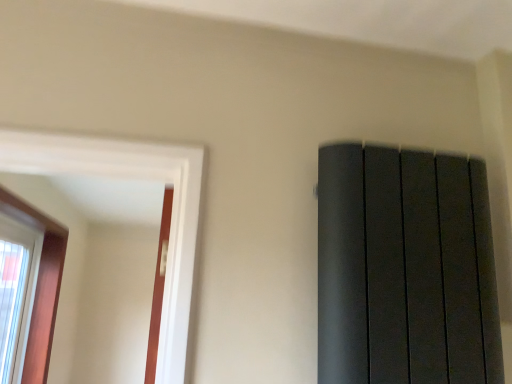
Question: In terms of width, does wooden frame window at left, positioned as the 1th window in right-to-left order, look wider or thinner when compared to clear glass window at left, the first window when ordered from left to right?

Choices:
 (A) wide
 (B) thin

Answer: (A)

Question: Considering the positions of wooden frame window at left, which ranks as the second window in left-to-right order, and clear glass window at left, the first window when ordered from left to right, in the image, is wooden frame window at left, which ranks as the second window in left-to-right order, bigger or smaller than clear glass window at left, the first window when ordered from left to right,?

Choices:
 (A) big
 (B) small

Answer: (A)

Question: From the image's perspective, is wooden frame window at left, positioned as the 1th window in right-to-left order, above or below clear glass window at left, the first window when ordered from left to right?

Choices:
 (A) above
 (B) below

Answer: (A)

Question: Based on their sizes in the image, would you say clear glass window at left, the 2th window positioned from the right, is bigger or smaller than wooden frame window at left, which ranks as the second window in left-to-right order?

Choices:
 (A) small
 (B) big

Answer: (A)

Question: Is clear glass window at left, the 2th window positioned from the right, in front of or behind wooden frame window at left, positioned as the 1th window in right-to-left order, in the image?

Choices:
 (A) front
 (B) behind

Answer: (B)

Question: From a real-world perspective, is clear glass window at left, the 2th window positioned from the right, above or below wooden frame window at left, which ranks as the second window in left-to-right order?

Choices:
 (A) above
 (B) below

Answer: (B)

Question: Is clear glass window at left, the 2th window positioned from the right, spatially inside wooden frame window at left, which ranks as the second window in left-to-right order, or outside of it?

Choices:
 (A) outside
 (B) inside

Answer: (A)